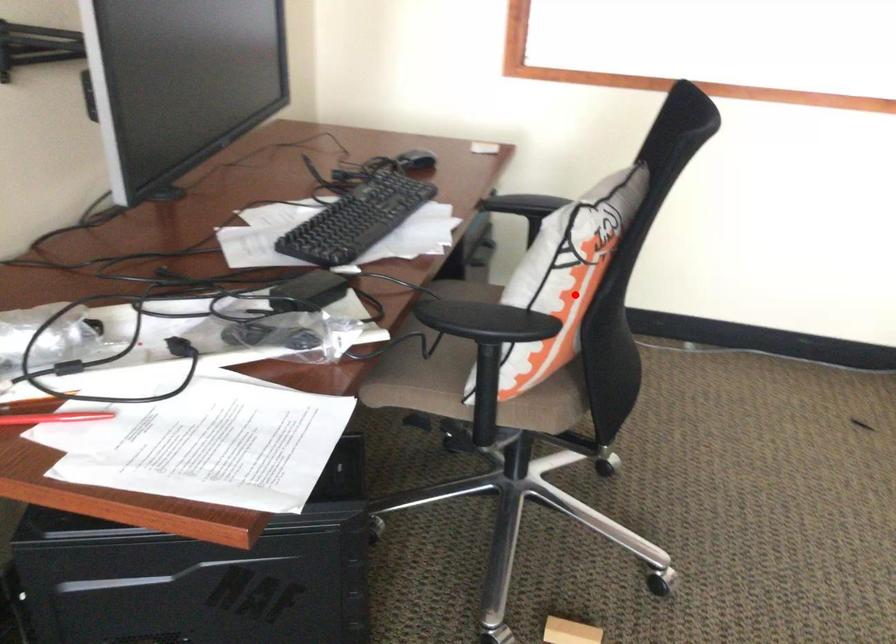
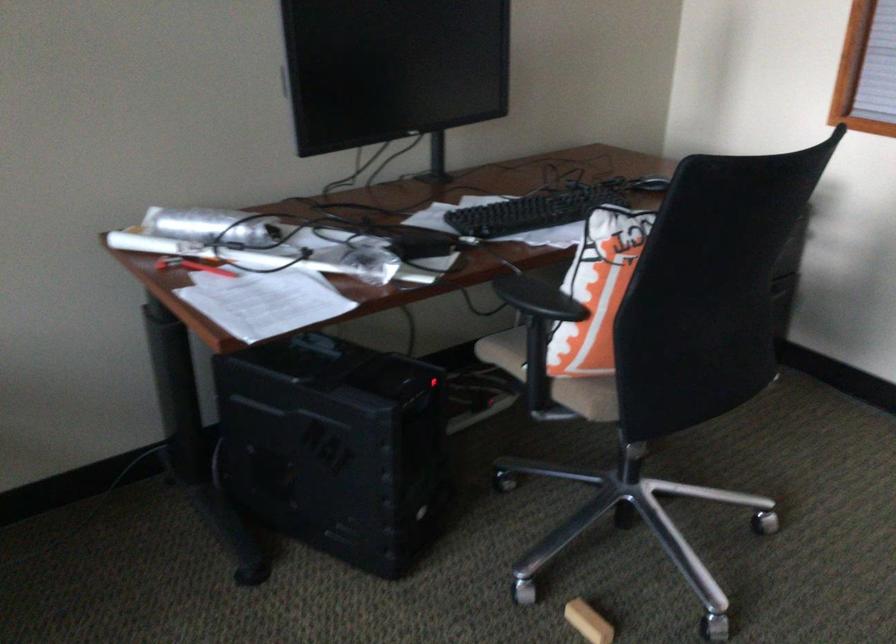
Where in the second image is the point corresponding to the highlighted location from the first image?

(597, 290)